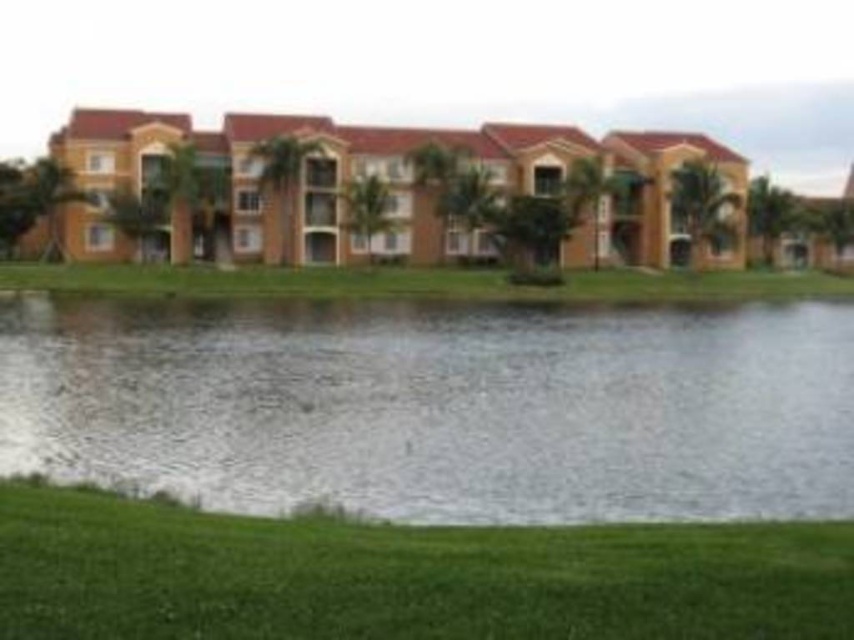
Between clear water at lower center and green grass at lower center, which one has less height?

green grass at lower center is shorter.

Which is more to the left, clear water at lower center or green grass at lower center?

green grass at lower center is more to the left.

Based on the photo, who is more distant from viewer, (496, 445) or (250, 621)?

The point (496, 445) is behind.

The height and width of the screenshot is (640, 854). Find the location of `clear water at lower center`. clear water at lower center is located at coordinates (437, 406).